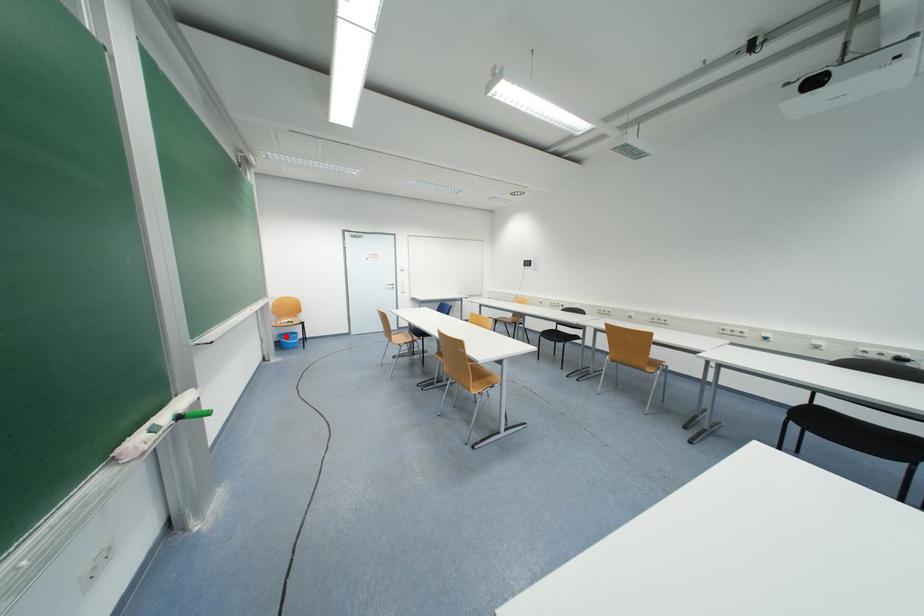
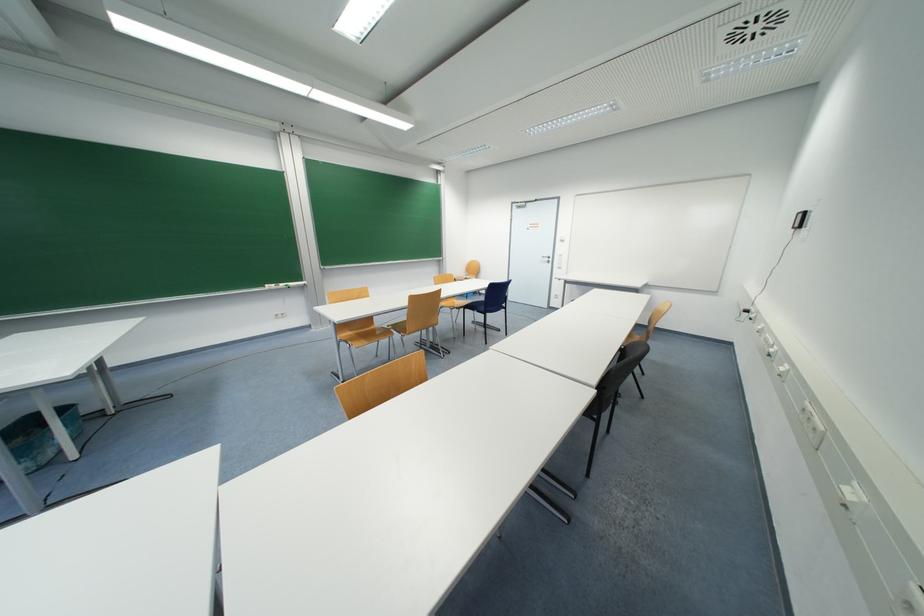
Question: I am providing you with two images of the same scene from different viewpoints. A red point is marked on the first image. At the location where the point appears in image 1, is it still visible in image 2?

Choices:
 (A) Yes
 (B) No

Answer: (B)